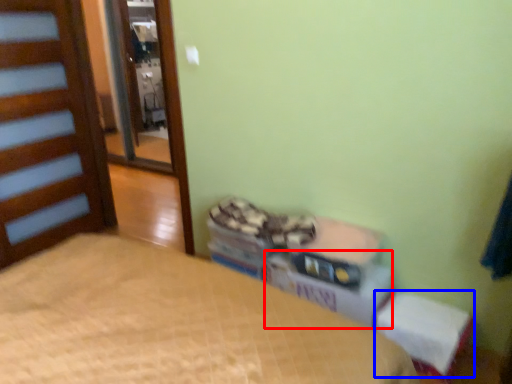
Question: Among these objects, which one is farthest to the camera, cardboard box (highlighted by a red box) or changing table (highlighted by a blue box)?

Choices:
 (A) cardboard box
 (B) changing table

Answer: (A)